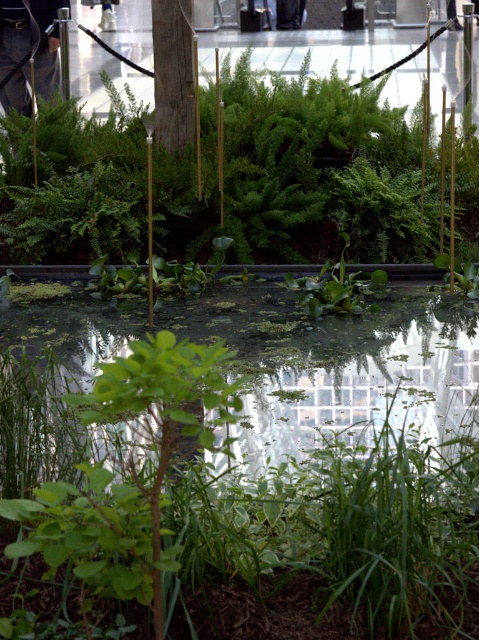
Is green leafy plant at upper center positioned before green leafy plant at center?

No, green leafy plant at upper center is further to the viewer.

Between green leafy plant at upper center and green leafy plant at center, which one is positioned lower?

green leafy plant at center is lower down.

Which is behind, point (356, 177) or point (365, 348)?

The point (356, 177) is more distant.

This screenshot has height=640, width=479. I want to click on green leafy plant at upper center, so click(322, 170).